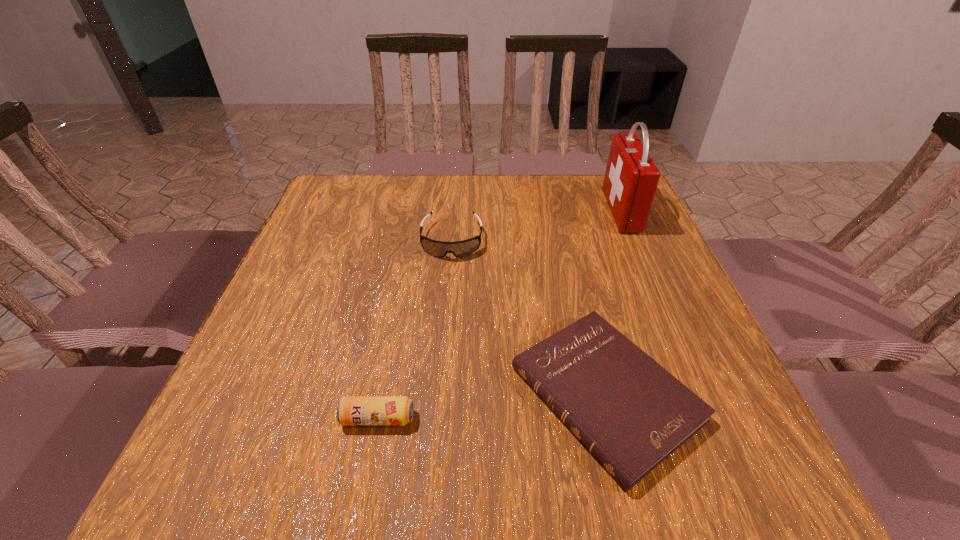
Find the location of a particular element. The width and height of the screenshot is (960, 540). the tallest object is located at coordinates (631, 178).

The width and height of the screenshot is (960, 540). What are the coordinates of `goggles` in the screenshot? It's located at (460, 249).

Where is `the third tallest object`? Image resolution: width=960 pixels, height=540 pixels. the third tallest object is located at coordinates (352, 410).

You are a GUI agent. You are given a task and a screenshot of the screen. Output one action in this format:
    pyautogui.click(x=<x>, y=<y>)
    Task: Click on the hardback book
    
    Given the screenshot: What is the action you would take?
    pyautogui.click(x=631, y=413)

Locate an element on the screen. This screenshot has width=960, height=540. free location located 0.330m on the front face of the tallest object is located at coordinates (488, 211).

Image resolution: width=960 pixels, height=540 pixels. I want to click on vacant region located 0.070m on the front face of the tallest object, so click(x=584, y=211).

This screenshot has height=540, width=960. Identify the location of vacant position located on the front face of the tallest object. (495, 211).

At what (x,y) coordinates should I click in order to perform the action: click on blank area located on the front and sides of the goggles. Please return your answer as a coordinate pair (x, y). The height and width of the screenshot is (540, 960). Looking at the image, I should click on (448, 284).

You are a GUI agent. You are given a task and a screenshot of the screen. Output one action in this format:
    pyautogui.click(x=<x>, y=<y>)
    Task: Click on the vacant area located on the right of the beer can
    This screenshot has height=540, width=960.
    Given the screenshot: What is the action you would take?
    pyautogui.click(x=568, y=418)

Image resolution: width=960 pixels, height=540 pixels. I want to click on blank space located on the back of the hardback book, so click(x=573, y=262).